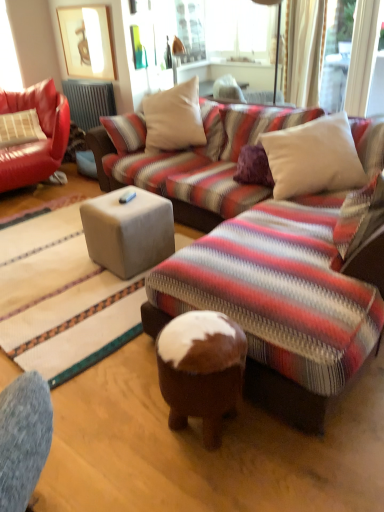
Question: Does leather couch at left lie behind white soft cushion at upper right, the 1th pillow when ordered from right to left?

Choices:
 (A) yes
 (B) no

Answer: (A)

Question: Considering the relative sizes of leather couch at left and white soft cushion at upper right, the 2th pillow from the back, in the image provided, is leather couch at left taller than white soft cushion at upper right, the 2th pillow from the back,?

Choices:
 (A) no
 (B) yes

Answer: (B)

Question: Is leather couch at left closer to camera compared to white soft cushion at upper right, acting as the 1th pillow starting from the front?

Choices:
 (A) yes
 (B) no

Answer: (B)

Question: Considering the relative sizes of leather couch at left and white soft cushion at upper right, the 1th pillow when ordered from right to left, in the image provided, is leather couch at left smaller than white soft cushion at upper right, the 1th pillow when ordered from right to left,?

Choices:
 (A) no
 (B) yes

Answer: (A)

Question: Is leather couch at left far away from white soft cushion at upper right, the 1th pillow when ordered from right to left?

Choices:
 (A) yes
 (B) no

Answer: (A)

Question: From a real-world perspective, is leather couch at left positioned above or below matte wooden picture frame at upper left?

Choices:
 (A) above
 (B) below

Answer: (B)

Question: From the image's perspective, relative to matte wooden picture frame at upper left, is leather couch at left above or below?

Choices:
 (A) below
 (B) above

Answer: (A)

Question: Is point 62,133 closer or farther from the camera than point 104,68?

Choices:
 (A) closer
 (B) farther

Answer: (A)

Question: Considering their positions, is leather couch at left located in front of or behind matte wooden picture frame at upper left?

Choices:
 (A) behind
 (B) front

Answer: (B)

Question: In the image, is leather pillow at left, placed as the second pillow when sorted from front to back, positioned in front of or behind white soft cushion at upper right, the 2th pillow from the back?

Choices:
 (A) behind
 (B) front

Answer: (A)

Question: Looking at their shapes, would you say leather pillow at left, which ranks as the 1th pillow in left-to-right order, is wider or thinner than white soft cushion at upper right, acting as the 2th pillow starting from the top?

Choices:
 (A) wide
 (B) thin

Answer: (B)

Question: Is point (13, 136) closer or farther from the camera than point (281, 150)?

Choices:
 (A) farther
 (B) closer

Answer: (A)

Question: From the image's perspective, is leather pillow at left, the second pillow ordered from the bottom, located above or below white soft cushion at upper right, acting as the 1th pillow starting from the front?

Choices:
 (A) below
 (B) above

Answer: (B)

Question: Is point (362, 172) positioned closer to the camera than point (144, 264)?

Choices:
 (A) farther
 (B) closer

Answer: (B)

Question: Is white soft cushion at upper right, the 1th pillow when ordered from right to left, bigger or smaller than suede-like beige cube at center?

Choices:
 (A) big
 (B) small

Answer: (A)